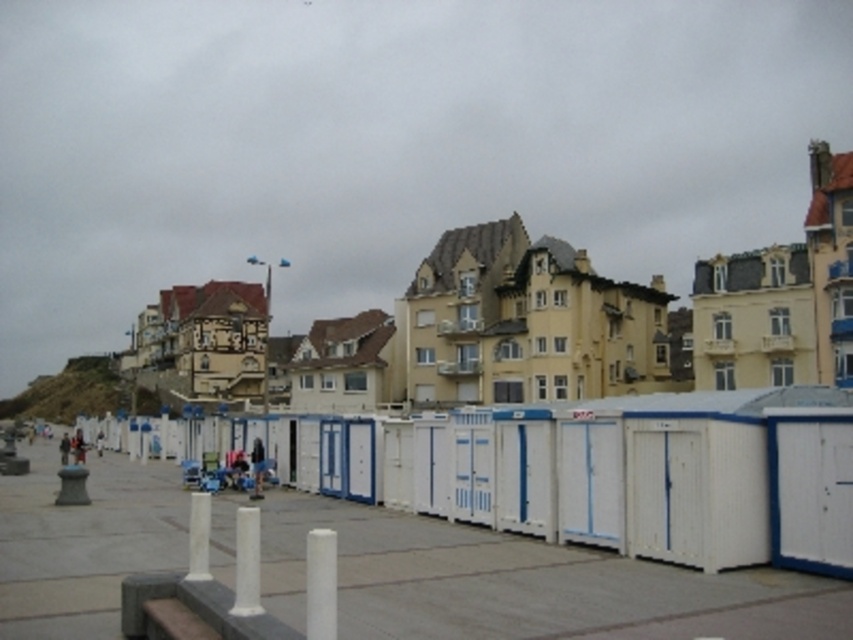
Question: Is white painted wood beach hut at center to the right of white smooth post at center from the viewer's perspective?

Choices:
 (A) no
 (B) yes

Answer: (B)

Question: Which point is closer to the camera?

Choices:
 (A) (335, 625)
 (B) (309, 435)
 (C) (202, 506)
 (D) (604, 280)

Answer: (A)

Question: Estimate the real-world distances between objects in this image. Which object is farther from the white wooden beach hut at center?

Choices:
 (A) white matte pole at center
 (B) white plastic pole at lower center
 (C) white painted wood fence at center

Answer: (A)

Question: Among these objects, which one is nearest to the camera?

Choices:
 (A) white wooden beach hut at center
 (B) white smooth post at center

Answer: (B)

Question: Can you confirm if white wooden beach hut at center is bigger than white matte pole at center?

Choices:
 (A) no
 (B) yes

Answer: (B)

Question: Does white painted wood fence at center have a greater width compared to white wooden beach hut at center?

Choices:
 (A) yes
 (B) no

Answer: (A)